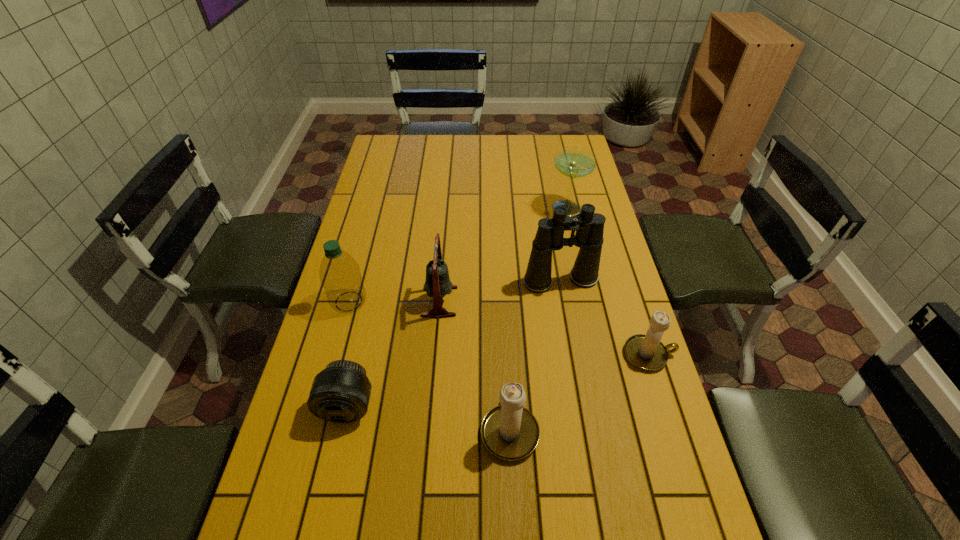
The image size is (960, 540). Identify the location of martini present at the right edge. tap(574, 162).

Where is `binoculars that is at the right edge`? binoculars that is at the right edge is located at coordinates (589, 226).

Locate an element on the screen. vacant space at the far edge of the desktop is located at coordinates tap(486, 142).

At what (x,y) coordinates should I click in order to perform the action: click on vacant space at the left edge of the desktop. Please return your answer as a coordinate pair (x, y). Looking at the image, I should click on (360, 205).

You are a GUI agent. You are given a task and a screenshot of the screen. Output one action in this format:
    pyautogui.click(x=<x>, y=<y>)
    Task: Click on the free space at the right edge
    Image resolution: width=960 pixels, height=540 pixels.
    Given the screenshot: What is the action you would take?
    pyautogui.click(x=581, y=306)

In the image, there is a desktop. Where is `vacant space at the near left corner`? This screenshot has width=960, height=540. vacant space at the near left corner is located at coordinates (338, 496).

Image resolution: width=960 pixels, height=540 pixels. What are the coordinates of `vacant region between the water bottle and the telephoto lens` in the screenshot? It's located at (348, 354).

You are a GUI agent. You are given a task and a screenshot of the screen. Output one action in this format:
    pyautogui.click(x=<x>, y=<y>)
    Task: Click on the vacant space that is in between the bell and the farthest object
    This screenshot has width=960, height=540.
    Given the screenshot: What is the action you would take?
    click(502, 255)

Locate an element on the screen. The image size is (960, 540). vacant area that lies between the binoculars and the water bottle is located at coordinates (455, 291).

The width and height of the screenshot is (960, 540). I want to click on empty space that is in between the telephoto lens and the water bottle, so click(x=348, y=354).